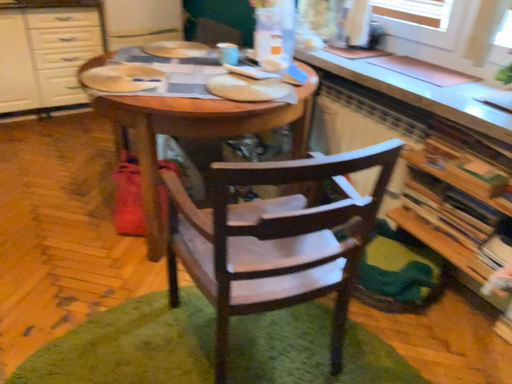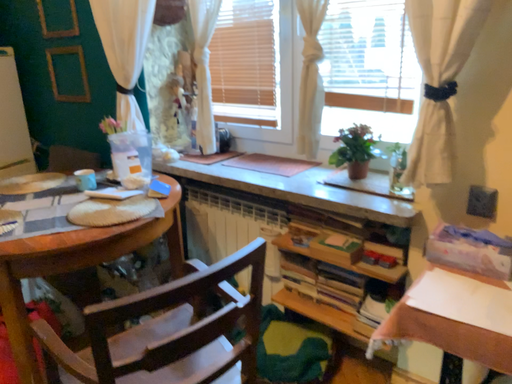
Question: How did the camera likely rotate when shooting the video?

Choices:
 (A) rotated upward
 (B) rotated downward

Answer: (A)